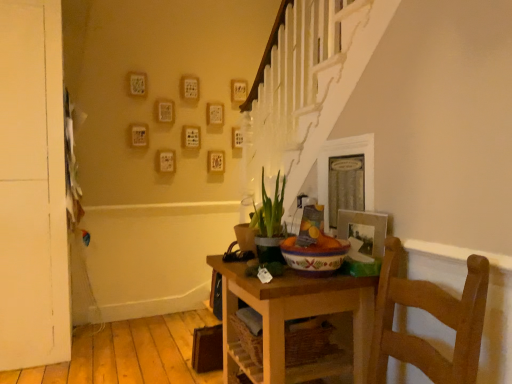
Question: Can you see green matte plant at center touching white matte door at left?

Choices:
 (A) no
 (B) yes

Answer: (A)

Question: Can you confirm if green matte plant at center is bigger than white matte door at left?

Choices:
 (A) no
 (B) yes

Answer: (A)

Question: Does green matte plant at center have a greater height compared to white matte door at left?

Choices:
 (A) no
 (B) yes

Answer: (A)

Question: Is green matte plant at center thinner than white matte door at left?

Choices:
 (A) yes
 (B) no

Answer: (A)

Question: Is green matte plant at center to the left of white matte door at left from the viewer's perspective?

Choices:
 (A) yes
 (B) no

Answer: (B)

Question: Considering the relative sizes of green matte plant at center and white matte door at left in the image provided, is green matte plant at center wider than white matte door at left?

Choices:
 (A) yes
 (B) no

Answer: (B)

Question: Is wooden table at center shorter than white matte door at left?

Choices:
 (A) no
 (B) yes

Answer: (B)

Question: Can you confirm if wooden table at center is bigger than white matte door at left?

Choices:
 (A) no
 (B) yes

Answer: (A)

Question: From a real-world perspective, is wooden table at center located higher than white matte door at left?

Choices:
 (A) yes
 (B) no

Answer: (B)

Question: Is wooden table at center thinner than white matte door at left?

Choices:
 (A) yes
 (B) no

Answer: (A)

Question: From the image's perspective, would you say wooden table at center is shown under white matte door at left?

Choices:
 (A) yes
 (B) no

Answer: (A)

Question: Is wooden table at center outside of white matte door at left?

Choices:
 (A) no
 (B) yes

Answer: (B)

Question: Is white matte door at left behind wooden table at center?

Choices:
 (A) yes
 (B) no

Answer: (A)